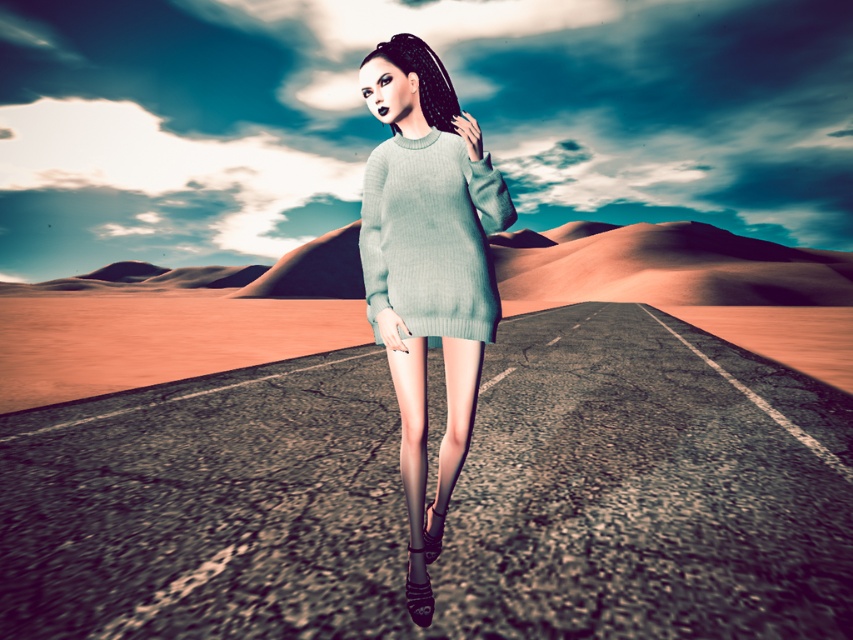
Question: Observing the image, what is the correct spatial positioning of light blue knitted sweater at center in reference to light blue knitted dress at center?

Choices:
 (A) right
 (B) left

Answer: (A)

Question: Which object is closer to the camera taking this photo?

Choices:
 (A) light blue knitted sweater at center
 (B) light blue knitted dress at center

Answer: (A)

Question: Where is light blue knitted sweater at center located in relation to light blue knitted dress at center in the image?

Choices:
 (A) right
 (B) left

Answer: (A)

Question: Does light blue knitted sweater at center come in front of light blue knitted dress at center?

Choices:
 (A) no
 (B) yes

Answer: (B)